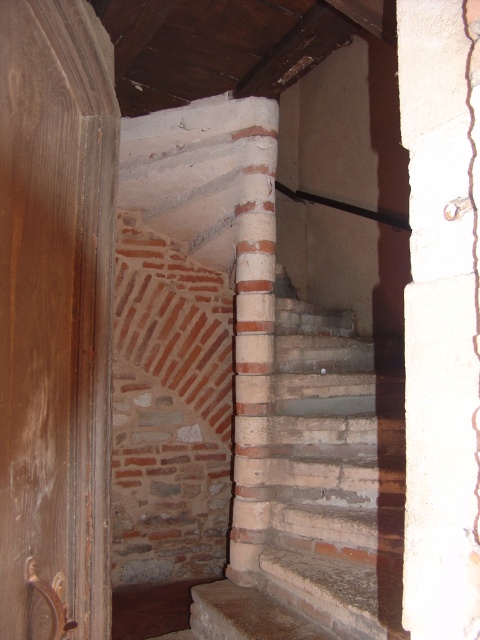
You are standing at the base of the spiral staircase in the historic building. You see a brown wood door at left. Based on its coordinates, is the door located to the left or right side of the staircase?

The brown wood door at left is located at coordinates point [56,316], which places it on the left side of the staircase.

You are standing at the base of the spiral staircase in the historic building. You notice two points marked on the wall adjacent to the staircase. One is labeled as point (x=286, y=602) and the other as point (x=471, y=1). Which point is closer to you?

Point (x=286, y=602) is closer to you because it is further to the viewer than point (x=471, y=1).